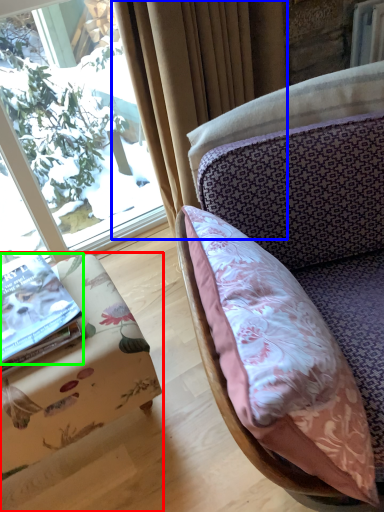
Question: Which is nearer to the furniture (highlighted by a red box)? curtain (highlighted by a blue box) or book (highlighted by a green box).

Choices:
 (A) curtain
 (B) book

Answer: (B)